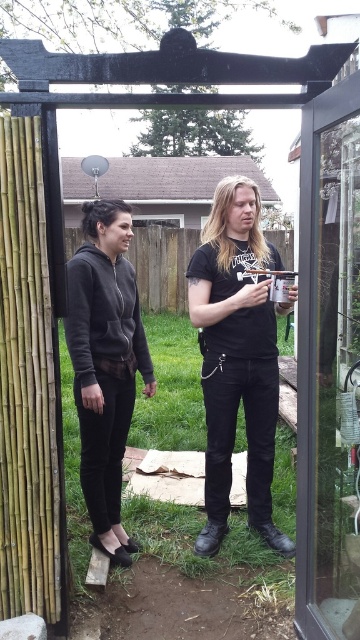
Question: Which of the following is the farthest from the observer?

Choices:
 (A) (344, 449)
 (B) (277, 310)
 (C) (96, 244)

Answer: (B)

Question: Can you confirm if matte black hoodie at center is positioned above dark gray hoodie at center?

Choices:
 (A) no
 (B) yes

Answer: (B)

Question: Which of these objects is positioned closest to the dark gray hoodie at center?

Choices:
 (A) transparent glass screen door at right
 (B) matte black hoodie at center

Answer: (B)

Question: Is matte black hoodie at center to the right of dark gray hoodie at center from the viewer's perspective?

Choices:
 (A) yes
 (B) no

Answer: (A)

Question: Observing the image, what is the correct spatial positioning of transparent glass screen door at right in reference to matte black hoodie at center?

Choices:
 (A) below
 (B) above

Answer: (A)

Question: Which point appears closest to the camera in this image?

Choices:
 (A) (326, 346)
 (B) (255, 209)
 (C) (78, 371)

Answer: (A)